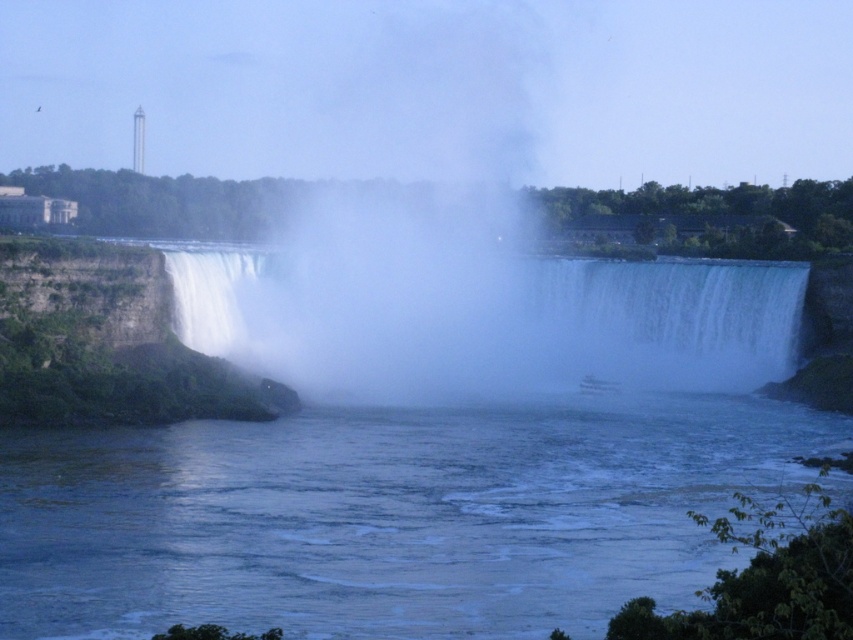
Between point (712, 483) and point (633, 337), which one is positioned behind?

Positioned behind is point (633, 337).

Which is above, clear water at center or white misty waterfall at center?

Positioned higher is white misty waterfall at center.

Is point (258, 451) positioned after point (770, 369)?

No, (258, 451) is in front of (770, 369).

This screenshot has height=640, width=853. I want to click on clear water at center, so click(387, 516).

Can you confirm if clear water at center is shorter than white mist at center?

Correct, clear water at center is not as tall as white mist at center.

From the picture: Is clear water at center to the right of white mist at center from the viewer's perspective?

Incorrect, clear water at center is not on the right side of white mist at center.

Does point (219, 465) come farther from viewer compared to point (756, 355)?

That is False.

This screenshot has height=640, width=853. What are the coordinates of `clear water at center` in the screenshot? It's located at (387, 516).

Which is more to the right, white mist at center or white misty waterfall at center?

From the viewer's perspective, white misty waterfall at center appears more on the right side.

Which is behind, point (448, 163) or point (212, 298)?

Positioned behind is point (448, 163).

This screenshot has width=853, height=640. Identify the location of white mist at center. (469, 189).